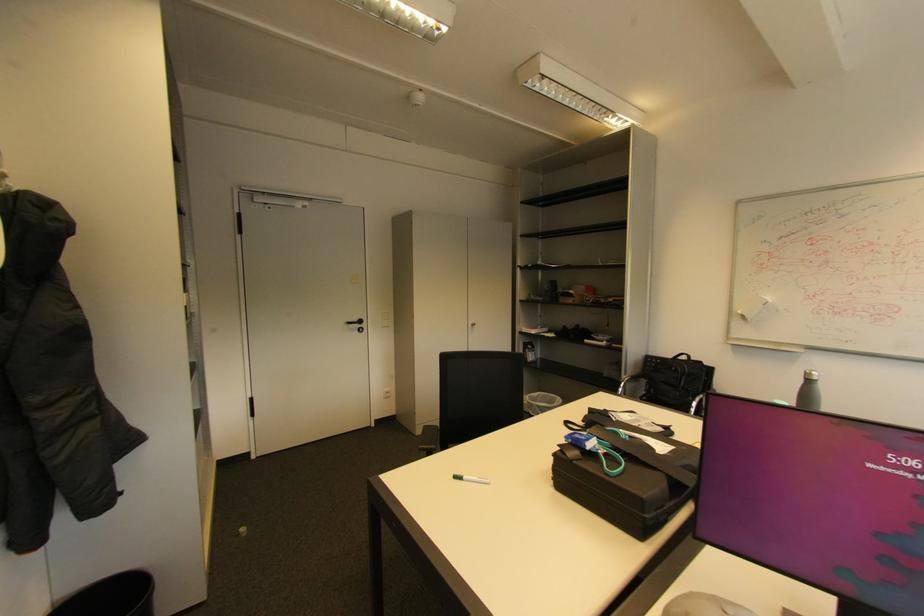
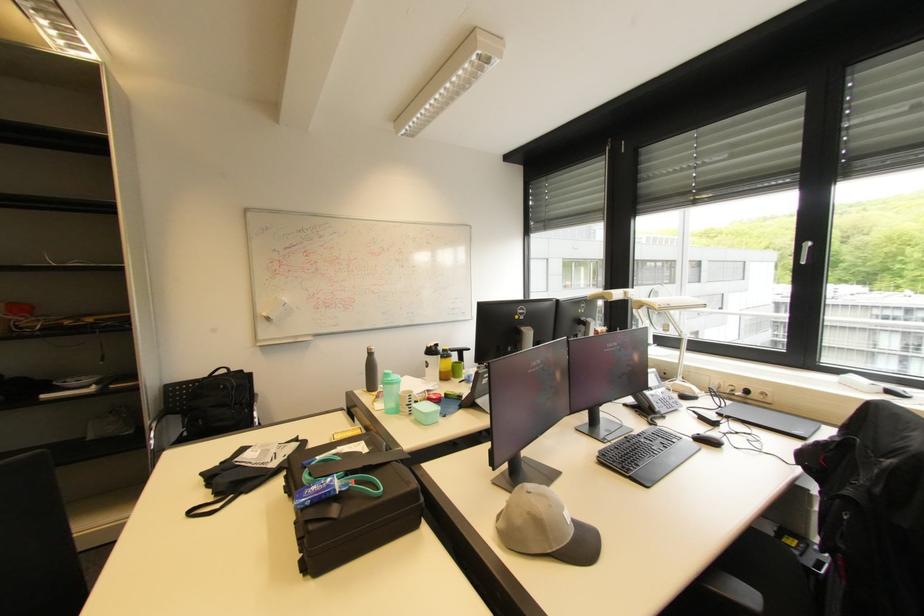
Where in the second image is the point corresponding to the point at 811,373 from the first image?

(372, 350)